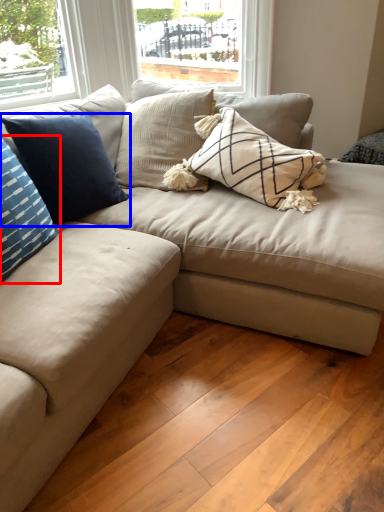
Question: Among these objects, which one is nearest to the camera, pillow (highlighted by a red box) or pillow (highlighted by a blue box)?

Choices:
 (A) pillow
 (B) pillow

Answer: (A)